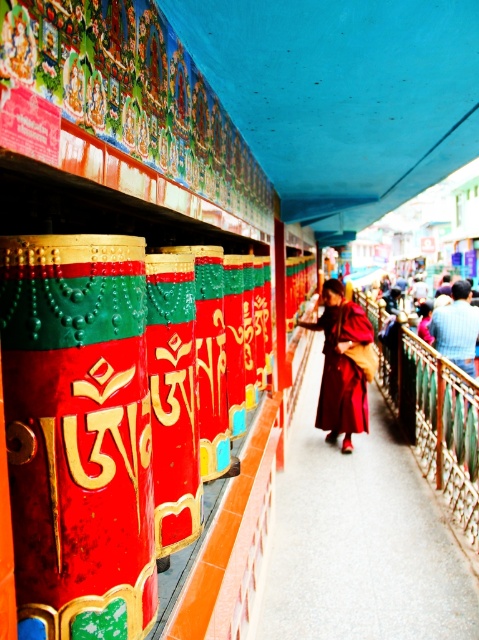
Question: Observing the image, what is the correct spatial positioning of maroon fabric robe at center in reference to dark blue woolen robe at center?

Choices:
 (A) left
 (B) right

Answer: (A)

Question: Among these points, which one is farthest from the camera?

Choices:
 (A) (324, 353)
 (B) (443, 337)

Answer: (B)

Question: Is maroon fabric robe at center below dark blue woolen robe at center?

Choices:
 (A) no
 (B) yes

Answer: (B)

Question: Can you confirm if maroon fabric robe at center is positioned above dark blue woolen robe at center?

Choices:
 (A) yes
 (B) no

Answer: (B)

Question: Which point is closer to the camera?

Choices:
 (A) (366, 416)
 (B) (434, 330)

Answer: (A)